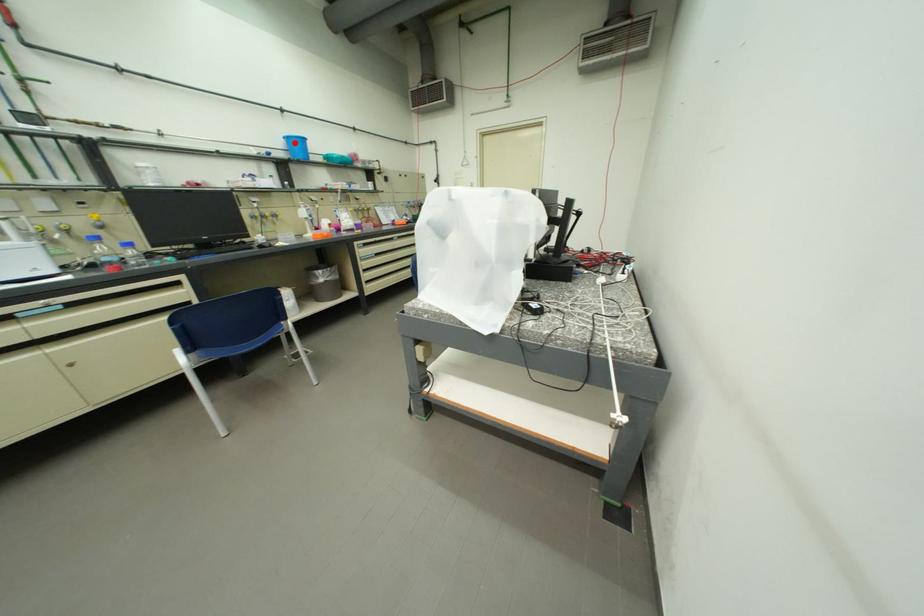
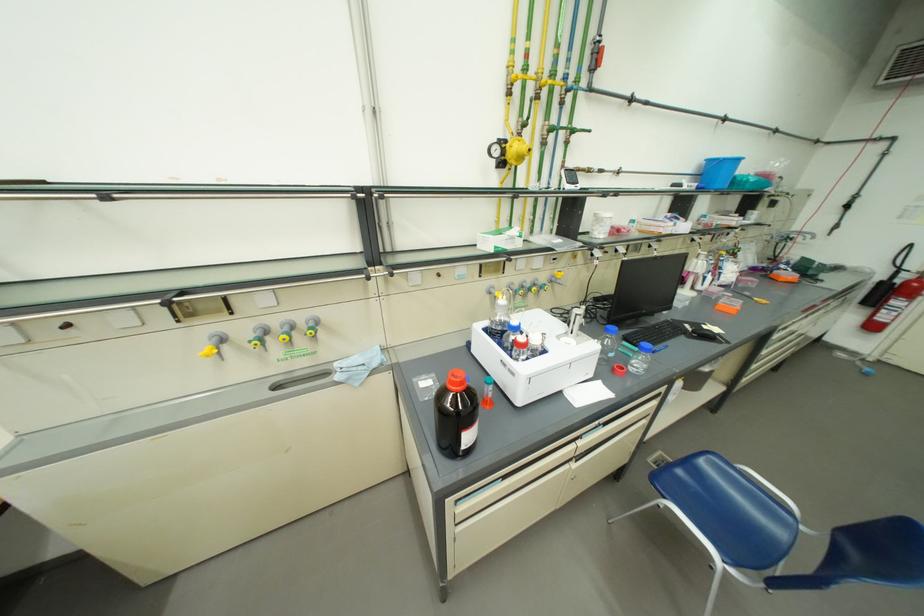
In the second image, find the point that corresponds to the highlighted location in the first image.

(712, 164)